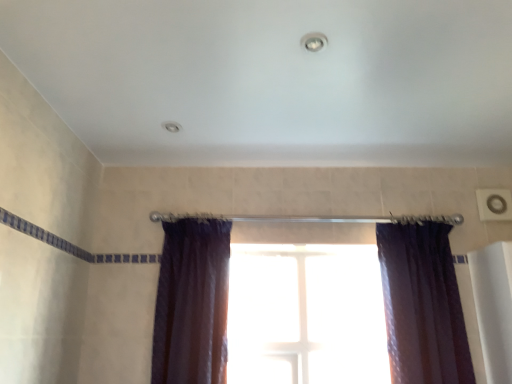
Question: Is satin purple curtain at right, which is the second curtain in left-to-right order, further to the viewer compared to satin dark purple curtain at center, placed as the 1th curtain when sorted from left to right?

Choices:
 (A) no
 (B) yes

Answer: (B)

Question: Is satin purple curtain at right, the 1th curtain from the right, at the right side of satin dark purple curtain at center, placed as the 1th curtain when sorted from left to right?

Choices:
 (A) no
 (B) yes

Answer: (B)

Question: Is satin purple curtain at right, the 1th curtain from the right, positioned beyond the bounds of satin dark purple curtain at center, positioned as the 2th curtain in right-to-left order?

Choices:
 (A) no
 (B) yes

Answer: (B)

Question: Can you confirm if satin purple curtain at right, which is the second curtain in left-to-right order, is bigger than satin dark purple curtain at center, placed as the 1th curtain when sorted from left to right?

Choices:
 (A) yes
 (B) no

Answer: (A)

Question: Would you say satin dark purple curtain at center, placed as the 1th curtain when sorted from left to right, is part of satin purple curtain at right, which is the second curtain in left-to-right order,'s contents?

Choices:
 (A) no
 (B) yes

Answer: (A)

Question: Considering the relative sizes of satin purple curtain at right, which is the second curtain in left-to-right order, and satin dark purple curtain at center, positioned as the 2th curtain in right-to-left order, in the image provided, is satin purple curtain at right, which is the second curtain in left-to-right order, shorter than satin dark purple curtain at center, positioned as the 2th curtain in right-to-left order,?

Choices:
 (A) yes
 (B) no

Answer: (A)

Question: Considering the relative sizes of transparent glass window at center and satin dark purple curtain at center, placed as the 1th curtain when sorted from left to right, in the image provided, is transparent glass window at center wider than satin dark purple curtain at center, placed as the 1th curtain when sorted from left to right,?

Choices:
 (A) yes
 (B) no

Answer: (B)

Question: Is transparent glass window at center positioned far away from satin dark purple curtain at center, placed as the 1th curtain when sorted from left to right?

Choices:
 (A) no
 (B) yes

Answer: (A)

Question: Is transparent glass window at center positioned in front of satin dark purple curtain at center, positioned as the 2th curtain in right-to-left order?

Choices:
 (A) yes
 (B) no

Answer: (B)

Question: Is transparent glass window at center outside of satin dark purple curtain at center, placed as the 1th curtain when sorted from left to right?

Choices:
 (A) yes
 (B) no

Answer: (A)

Question: Would you say transparent glass window at center contains satin dark purple curtain at center, placed as the 1th curtain when sorted from left to right?

Choices:
 (A) yes
 (B) no

Answer: (B)

Question: Could you tell me if transparent glass window at center is facing satin dark purple curtain at center, placed as the 1th curtain when sorted from left to right?

Choices:
 (A) yes
 (B) no

Answer: (B)

Question: Is satin purple curtain at right, the 1th curtain from the right, facing towards transparent glass window at center?

Choices:
 (A) yes
 (B) no

Answer: (B)